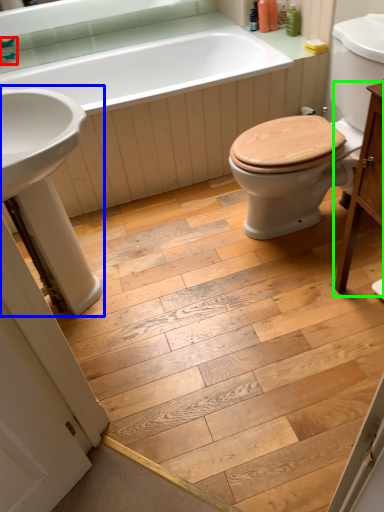
Question: Which is farther away from faucet (highlighted by a red box)? sink (highlighted by a blue box) or vanity (highlighted by a green box)?

Choices:
 (A) sink
 (B) vanity

Answer: (B)